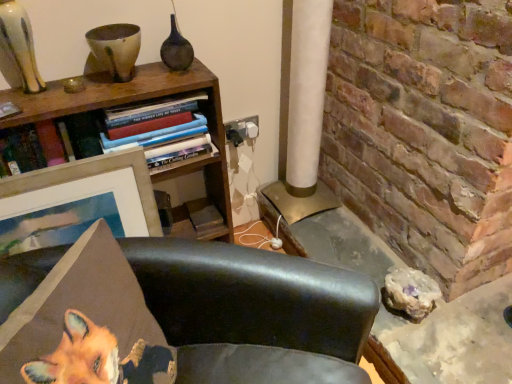
Identify the location of wooden picture frame at upper left. (77, 202).

Measure the distance between wooden picture frame at upper left and camera.

wooden picture frame at upper left and camera are 3.63 feet apart.

What is the approximate width of leather chair at lower center?

leather chair at lower center is 31.17 inches in width.

In order to click on metallic gold table at lower right in this screenshot , I will do `click(453, 339)`.

Identify the location of wooden picture frame at upper left. The width and height of the screenshot is (512, 384). (77, 202).

Identify the location of bookcase on the left of matte dark brown vase at upper center. The image size is (512, 384). (137, 102).

How many degrees apart are the facing directions of woodenmaterial/texturebookcase at upper left and matte dark brown vase at upper center?

0.501 degrees separate the facing orientations of woodenmaterial/texturebookcase at upper left and matte dark brown vase at upper center.

Who is smaller, woodenmaterial/texturebookcase at upper left or matte dark brown vase at upper center?

Smaller between the two is matte dark brown vase at upper center.

Is woodenmaterial/texturebookcase at upper left oriented towards matte dark brown vase at upper center?

No, woodenmaterial/texturebookcase at upper left does not turn towards matte dark brown vase at upper center.

Where is `picture frame above the metallic gold table at lower right (from the image's perspective)`? The image size is (512, 384). picture frame above the metallic gold table at lower right (from the image's perspective) is located at coordinates [77, 202].

Would you consider metallic gold table at lower right to be distant from wooden picture frame at upper left?

metallic gold table at lower right is actually quite close to wooden picture frame at upper left.

From a real-world perspective, which is physically above, metallic gold table at lower right or wooden picture frame at upper left?

wooden picture frame at upper left.

Choose the correct answer: Is metallic gold table at lower right inside wooden picture frame at upper left or outside it?

metallic gold table at lower right lies outside wooden picture frame at upper left.

Who is smaller, woodenmaterial/texturebookcase at upper left or metallic gold table at lower right?

With smaller size is woodenmaterial/texturebookcase at upper left.

In the image, is woodenmaterial/texturebookcase at upper left on the left side or the right side of metallic gold table at lower right?

Based on their positions, woodenmaterial/texturebookcase at upper left is located to the left of metallic gold table at lower right.

Is the depth of woodenmaterial/texturebookcase at upper left greater than that of metallic gold table at lower right?

Result: No.

Between woodenmaterial/texturebookcase at upper left and metallic gold table at lower right, which one has larger width?

With larger width is metallic gold table at lower right.

Which of these two, wooden picture frame at upper left or hardcover books at upper left, is thinner?

With smaller width is wooden picture frame at upper left.

Considering the positions of objects wooden picture frame at upper left and hardcover books at upper left in the image provided, who is more to the left, wooden picture frame at upper left or hardcover books at upper left?

From the viewer's perspective, wooden picture frame at upper left appears more on the left side.

Which is more distant, (10, 224) or (183, 153)?

The point (183, 153) is more distant.

From a real-world perspective, is wooden picture frame at upper left physically above hardcover books at upper left?

Actually, wooden picture frame at upper left is physically below hardcover books at upper left in the real world.

Consider the image. Is white paper lampshade at center at the right side of matte dark brown vase at upper center?

Indeed, white paper lampshade at center is positioned on the right side of matte dark brown vase at upper center.

Based on the photo, can you confirm if white paper lampshade at center is taller than matte dark brown vase at upper center?

Correct, white paper lampshade at center is much taller as matte dark brown vase at upper center.

Identify the location of pillar lying below the matte dark brown vase at upper center (from the image's perspective). Image resolution: width=512 pixels, height=384 pixels. (305, 115).

How many degrees apart are the facing directions of white paper lampshade at center and matte dark brown vase at upper center?

The angular difference between white paper lampshade at center and matte dark brown vase at upper center is 0.102 degrees.

From the image's perspective, which is below, hardcover books at upper left or woodenmaterial/texturebookcase at upper left?

woodenmaterial/texturebookcase at upper left is shown below in the image.

Based on the photo, are hardcover books at upper left and woodenmaterial/texturebookcase at upper left located far from each other?

They are positioned close to each other.

Can you confirm if hardcover books at upper left is wider than woodenmaterial/texturebookcase at upper left?

Yes, hardcover books at upper left is wider than woodenmaterial/texturebookcase at upper left.

From a real-world perspective, who is located higher, hardcover books at upper left or woodenmaterial/texturebookcase at upper left?

From a 3D spatial view, hardcover books at upper left is above.

Considering the sizes of objects wooden picture frame at upper left and leather chair at lower center in the image provided, who is thinner, wooden picture frame at upper left or leather chair at lower center?

With smaller width is wooden picture frame at upper left.

How many degrees apart are the facing directions of wooden picture frame at upper left and leather chair at lower center?

47.7 degrees.

From a real-world perspective, who is located lower, wooden picture frame at upper left or leather chair at lower center?

In real-world perspective, leather chair at lower center is lower.

Find the location of a particular element. The width and height of the screenshot is (512, 384). bookcase that is below the matte dark brown vase at upper center (from the image's perspective) is located at coordinates (137, 102).

This screenshot has height=384, width=512. Identify the location of table on the right side of wooden picture frame at upper left. (453, 339).

Estimate the real-world distances between objects in this image. Which object is closer to hardcover books at upper left, matte dark brown vase at upper center or wooden picture frame at upper left?

wooden picture frame at upper left is closer to hardcover books at upper left.

When comparing their distances from white paper lampshade at center, does woodenmaterial/texturebookcase at upper left or hardcover books at upper left seem closer?

woodenmaterial/texturebookcase at upper left lies closer to white paper lampshade at center than the other object.

From the image, which object appears to be nearer to matte dark brown vase at upper center, white paper lampshade at center or hardcover books at upper left?

Based on the image, hardcover books at upper left appears to be nearer to matte dark brown vase at upper center.

From the image, which object appears to be farther from hardcover books at upper left, leather chair at lower center or matte dark brown vase at upper center?

leather chair at lower center.

Estimate the real-world distances between objects in this image. Which object is further from matte dark brown vase at upper center, wooden picture frame at upper left or white paper lampshade at center?

white paper lampshade at center lies further to matte dark brown vase at upper center than the other object.

Estimate the real-world distances between objects in this image. Which object is closer to metallic gold table at lower right, hardcover books at upper left or wooden picture frame at upper left?

The object closer to metallic gold table at lower right is hardcover books at upper left.

When comparing their distances from matte dark brown vase at upper center, does metallic gold table at lower right or white paper lampshade at center seem further?

The object further to matte dark brown vase at upper center is metallic gold table at lower right.

Which object lies further to the anchor point white paper lampshade at center, wooden picture frame at upper left or metallic gold table at lower right?

The object further to white paper lampshade at center is wooden picture frame at upper left.

The width and height of the screenshot is (512, 384). Find the location of `bookcase between matte dark brown vase at upper center and leather chair at lower center in the up-down direction`. bookcase between matte dark brown vase at upper center and leather chair at lower center in the up-down direction is located at coordinates (137, 102).

Find the location of `book between matte dark brown vase at upper center and woodenmaterial/texturebookcase at upper left vertically`. book between matte dark brown vase at upper center and woodenmaterial/texturebookcase at upper left vertically is located at coordinates (168, 133).

Locate an element on the screen. This screenshot has height=384, width=512. vase between hardcover books at upper left and metallic gold table at lower right in the horizontal direction is located at coordinates (176, 49).

At what (x,y) coordinates should I click in order to perform the action: click on chair between matte dark brown vase at upper center and metallic gold table at lower right from left to right. Please return your answer as a coordinate pair (x, y). Looking at the image, I should click on (222, 318).